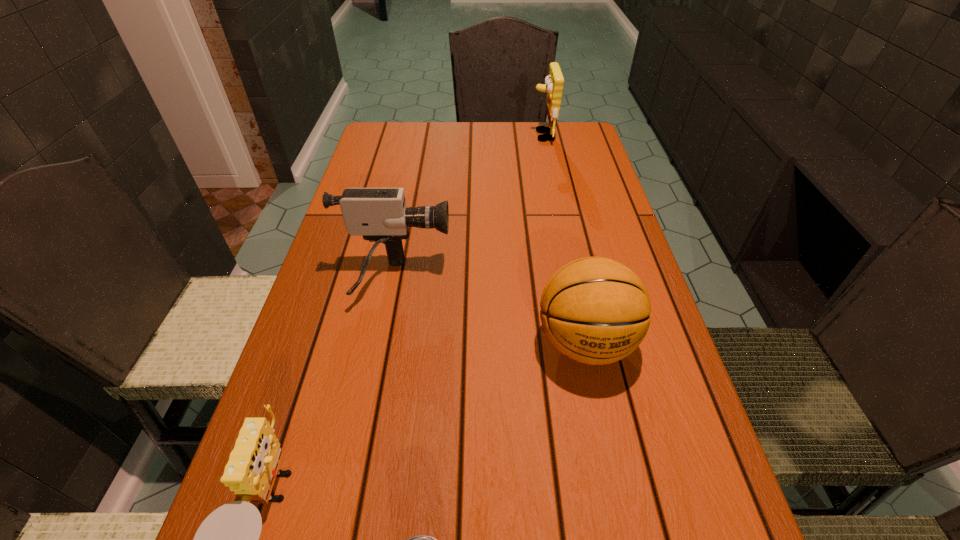
This screenshot has width=960, height=540. In order to click on the farthest object in this screenshot , I will do pos(553,84).

The image size is (960, 540). Identify the location of the farther sponge. (553, 84).

Identify the location of camcorder. Image resolution: width=960 pixels, height=540 pixels. (380, 215).

I want to click on basketball, so click(594, 310).

Locate an element on the screen. Image resolution: width=960 pixels, height=540 pixels. vacant space located 0.210m on the face of the farther sponge is located at coordinates (468, 136).

Find the location of a particular element. The image size is (960, 540). vacant space positioned on the face of the farther sponge is located at coordinates (448, 136).

This screenshot has width=960, height=540. Identify the location of vacant space located on the face of the farther sponge. pyautogui.click(x=475, y=136).

The height and width of the screenshot is (540, 960). Identify the location of free space located 0.270m on the recording direction of the camcorder. (569, 280).

I want to click on blank space located 0.050m on the surface of the basketball near the brand logo, so click(599, 411).

Where is `object that is at the far edge`? The image size is (960, 540). object that is at the far edge is located at coordinates (553, 84).